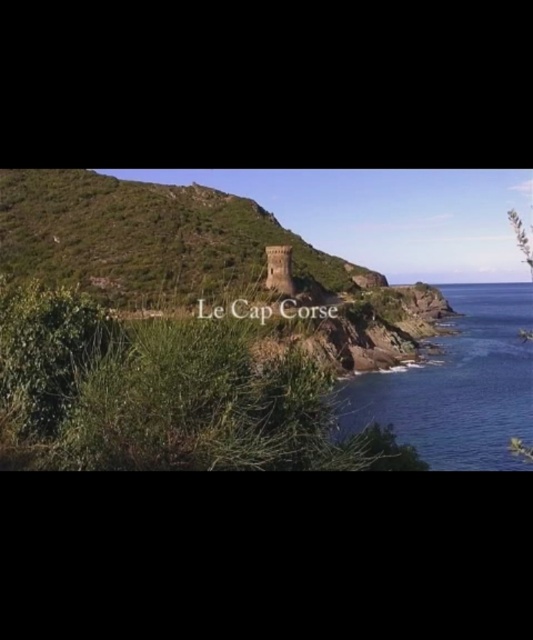
Question: Is the position of green grassy hillside at center more distant than that of blue glossy water at lower right?

Choices:
 (A) no
 (B) yes

Answer: (B)

Question: Is green grassy hillside at center further to the viewer compared to blue glossy water at lower right?

Choices:
 (A) yes
 (B) no

Answer: (A)

Question: Is green grassy hillside at center to the right of blue glossy water at lower right from the viewer's perspective?

Choices:
 (A) yes
 (B) no

Answer: (B)

Question: Which point is closer to the camera taking this photo?

Choices:
 (A) (496, 333)
 (B) (246, 230)

Answer: (B)

Question: Which point is closer to the camera?

Choices:
 (A) (38, 273)
 (B) (471, 403)

Answer: (B)

Question: Which object is farther from the camera taking this photo?

Choices:
 (A) blue glossy water at lower right
 (B) green grassy hillside at center

Answer: (B)